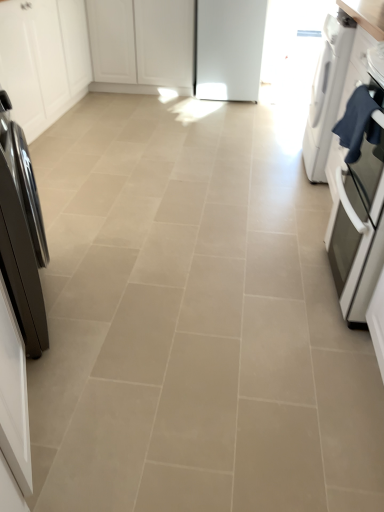
You are a GUI agent. You are given a task and a screenshot of the screen. Output one action in this format:
    pyautogui.click(x=<x>, y=<y>)
    Task: Click on the free location in front of white matte cabinet at center, the second cabinetry viewed from the left
    This screenshot has height=512, width=384.
    Given the screenshot: What is the action you would take?
    pyautogui.click(x=165, y=104)